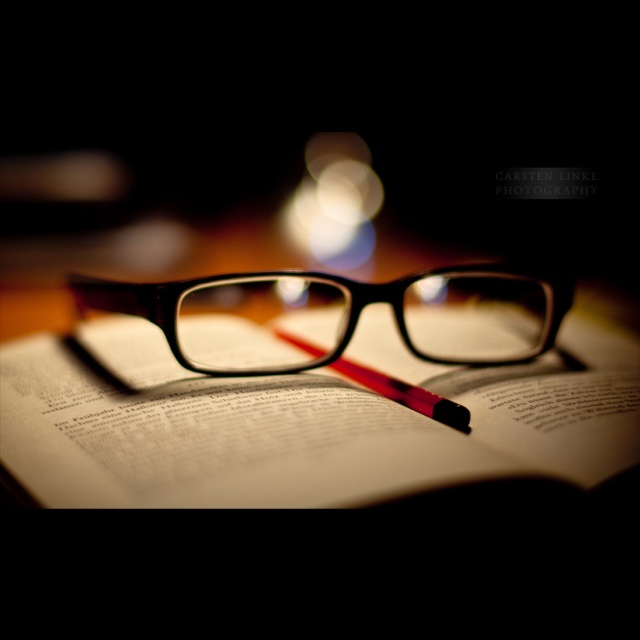
Question: Which point is farther from the camera taking this photo?

Choices:
 (A) (458, 422)
 (B) (428, 324)

Answer: (B)

Question: Which object is farther from the camera taking this photo?

Choices:
 (A) paper book at center
 (B) red rubberized pencil at center

Answer: (B)

Question: Can you confirm if black plastic glasses at center is smaller than red rubberized pencil at center?

Choices:
 (A) yes
 (B) no

Answer: (B)

Question: Does paper book at center appear on the left side of black plastic glasses at center?

Choices:
 (A) yes
 (B) no

Answer: (B)

Question: Considering the real-world distances, which object is closest to the red rubberized pencil at center?

Choices:
 (A) black plastic glasses at center
 (B) paper book at center

Answer: (A)

Question: Does paper book at center appear under red rubberized pencil at center?

Choices:
 (A) yes
 (B) no

Answer: (B)